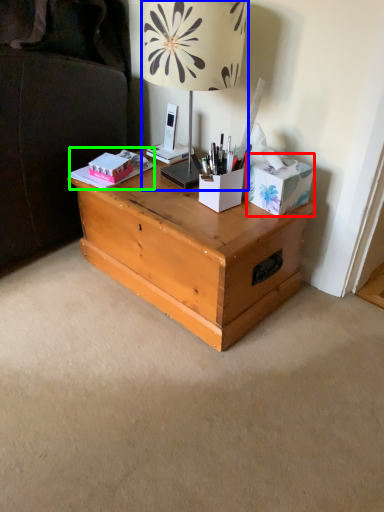
Question: Considering the real-world distances, which object is farthest from cardboard box (highlighted by a red box)? lamp (highlighted by a blue box) or book (highlighted by a green box)?

Choices:
 (A) lamp
 (B) book

Answer: (B)